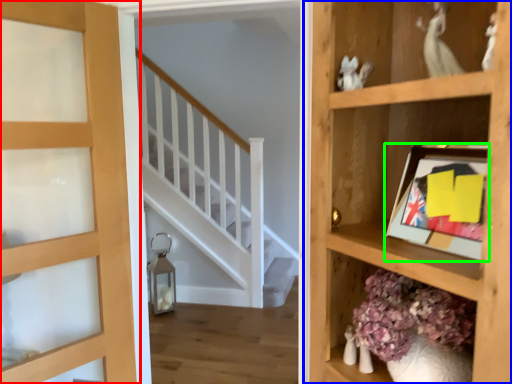
Question: Which object is positioned closest to door (highlighted by a red box)? Select from shelf (highlighted by a blue box) and picture frame (highlighted by a green box).

Choices:
 (A) shelf
 (B) picture frame

Answer: (A)